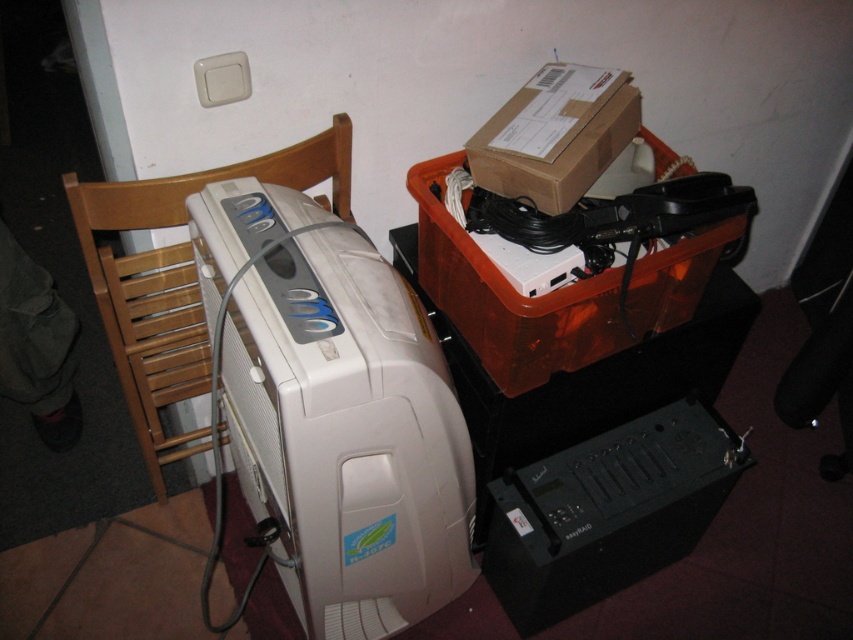
Is black plastic table at lower right shorter than brown cardboard box at upper right?

No.

Where is `black plastic table at lower right`? Image resolution: width=853 pixels, height=640 pixels. black plastic table at lower right is located at coordinates (584, 378).

This screenshot has width=853, height=640. In order to click on black plastic table at lower right in this screenshot , I will do `click(584, 378)`.

Is white plastic printer at left to the right of black plastic table at lower right from the viewer's perspective?

Incorrect, white plastic printer at left is not on the right side of black plastic table at lower right.

Looking at this image, does white plastic printer at left have a lesser height compared to black plastic table at lower right?

No, white plastic printer at left is not shorter than black plastic table at lower right.

Which is in front, point (460, 420) or point (711, 317)?

Point (460, 420)

Identify the location of white plastic printer at left. (347, 435).

Is white plastic printer at left thinner than wooden at left?

Yes, white plastic printer at left is thinner than wooden at left.

Who is higher up, white plastic printer at left or wooden at left?

wooden at left is higher up.

Between point (450, 538) and point (335, 147), which one is positioned behind?

The point (450, 538) is behind.

The width and height of the screenshot is (853, 640). I want to click on white plastic printer at left, so click(x=347, y=435).